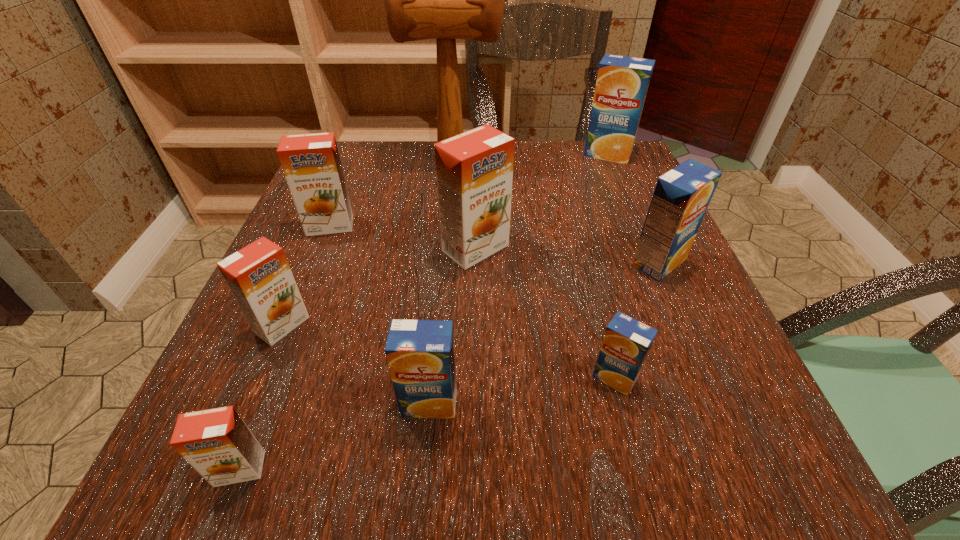
Locate an element on the screen. Image resolution: width=960 pixels, height=540 pixels. free spot that satisfies the following two spatial constraints: 1. on the back side of the sixth orange juice from left to right; 2. on the left side of the biggest blue orange_juice is located at coordinates (558, 154).

What are the coordinates of `free space that satisfies the following two spatial constraints: 1. on the strike surface of the tallest object; 2. on the front side of the fourth nearest object` in the screenshot? It's located at (438, 325).

Locate an element on the screen. free region that satisfies the following two spatial constraints: 1. on the back side of the smallest blue orange_juice; 2. on the left side of the smallest orange orange juice is located at coordinates (276, 378).

Locate an element on the screen. The width and height of the screenshot is (960, 540). free space that satisfies the following two spatial constraints: 1. on the back side of the third farthest orange orange juice; 2. on the left side of the farthest orange juice is located at coordinates (353, 154).

Find the location of `blank area in the image that satisfies the following two spatial constraints: 1. on the strike surface of the second biggest blue orange_juice; 2. on the left side of the tallest object`. blank area in the image that satisfies the following two spatial constraints: 1. on the strike surface of the second biggest blue orange_juice; 2. on the left side of the tallest object is located at coordinates (443, 262).